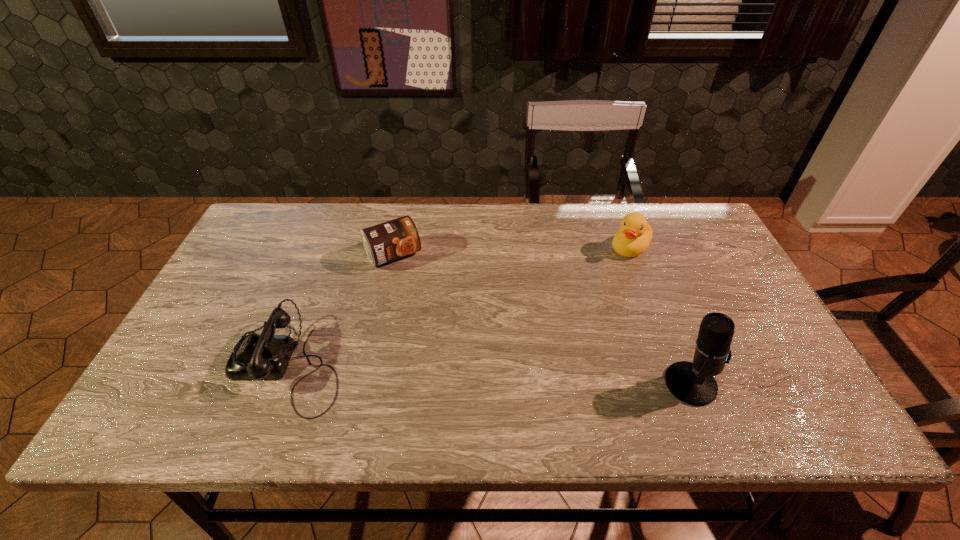
You are a GUI agent. You are given a task and a screenshot of the screen. Output one action in this format:
    pyautogui.click(x=<x>, y=<y>)
    Task: Click on the free space located 0.210m on the front label of the can
    The image size is (960, 540).
    Given the screenshot: What is the action you would take?
    pyautogui.click(x=437, y=321)

Locate an element on the screen. Image resolution: width=960 pixels, height=540 pixels. vacant space located 0.320m on the front label of the can is located at coordinates pos(456,352).

Image resolution: width=960 pixels, height=540 pixels. What are the coordinates of `free location located 0.320m on the front label of the can` in the screenshot? It's located at (456, 352).

This screenshot has height=540, width=960. In order to click on duck located in the far edge section of the desktop in this screenshot , I will do `click(634, 237)`.

I want to click on can that is at the far edge, so coord(385,242).

Locate an element on the screen. telephone that is at the near edge is located at coordinates (255, 357).

Identify the location of microphone that is at the near edge. (693, 383).

The image size is (960, 540). What are the coordinates of `object located at the left edge` in the screenshot? It's located at (255, 357).

Where is `object positioned at the near left corner`? Image resolution: width=960 pixels, height=540 pixels. object positioned at the near left corner is located at coordinates (255, 357).

This screenshot has width=960, height=540. In order to click on vacant space at the far edge of the desktop in this screenshot , I will do `click(595, 221)`.